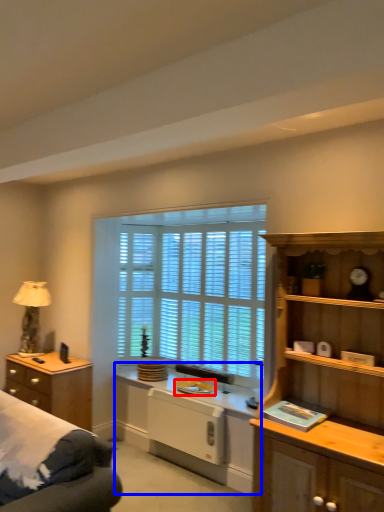
Question: Which point is further to the camera, appliance (highlighted by a red box) or computer desk (highlighted by a blue box)?

Choices:
 (A) appliance
 (B) computer desk

Answer: (A)